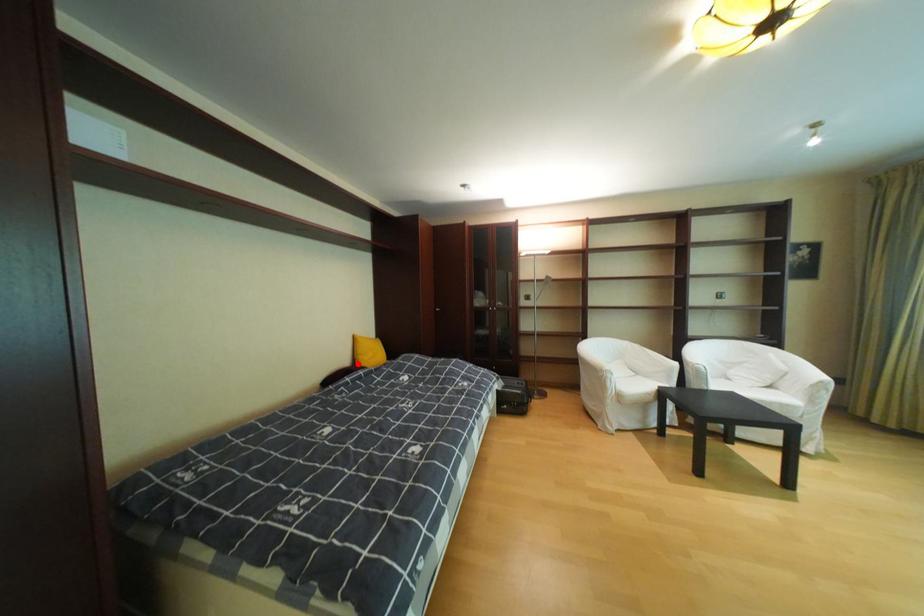
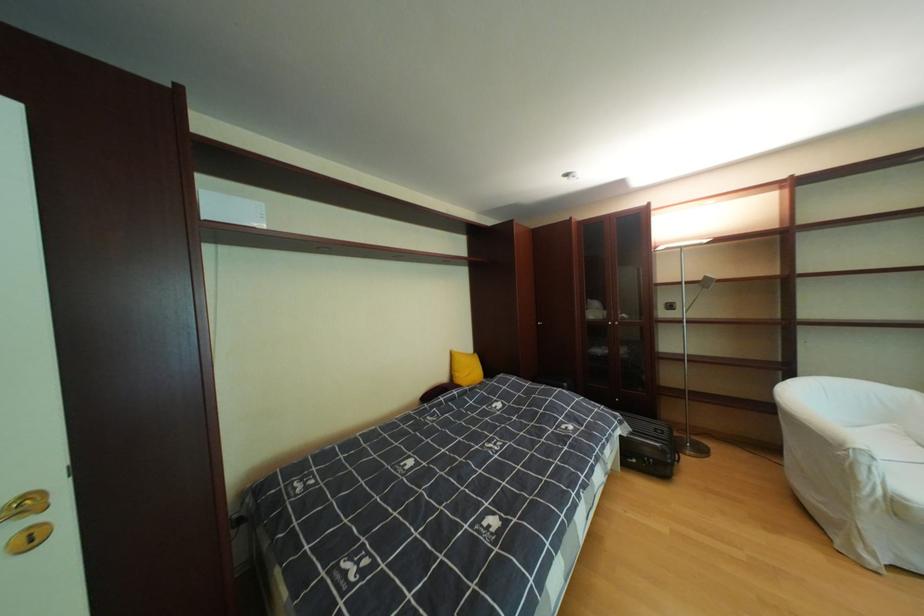
In the second image, find the point that corresponds to the highlighted location in the first image.

(456, 379)